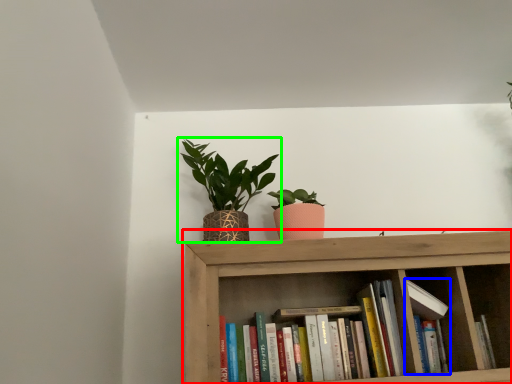
Question: Which object is the closest to the shelf (highlighted by a red box)? Choose among these: book (highlighted by a blue box) or houseplant (highlighted by a green box).

Choices:
 (A) book
 (B) houseplant

Answer: (A)